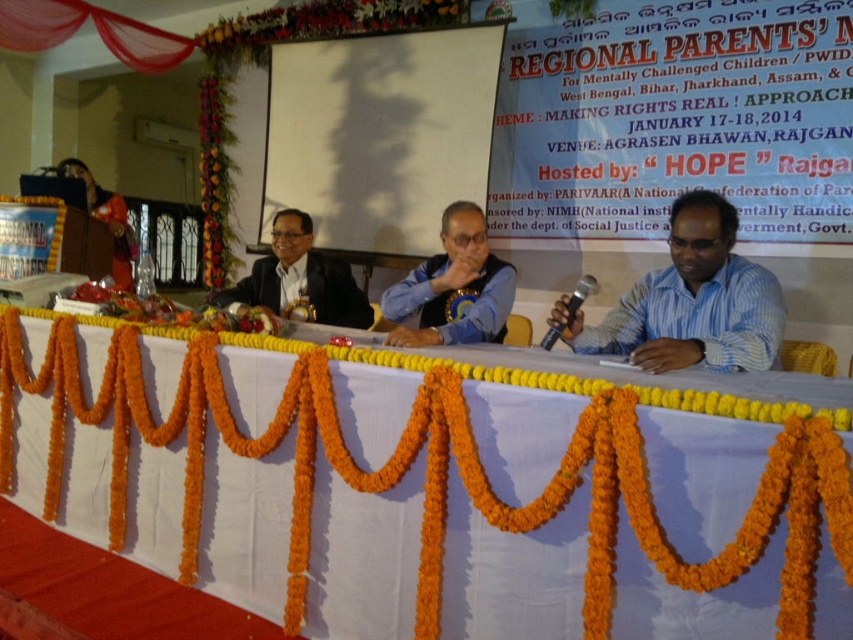
You are a photographer at the event and need to position yourself to capture both the white fabric table at center and the satin black suit at center in a single frame. Based on their positions, which object should you focus on first to ensure both are in the shot?

The white fabric table at center is below the satin black suit at center, so you should focus on the satin black suit at center first to ensure both are in the shot.

Based on the scene description and the objects provided, what is the purpose of the point labeled as point [428,470]?

The point labeled as point [428,470] represents the white fabric table at center.

You are organizing a small discussion group during the Regional Parents Meeting. You need to place a 1.2 meter wide discussion table at the center of the room. The existing white fabric table at center is currently occupying the space. Can you move it to a different location without blocking the banner? Please explain your reasoning.

The white fabric table at center is located at point (428, 470). Since the banner is in the background, moving the table to a position closer to the front or sides of the hall would avoid blocking it. However, the exact feasibility depends on the hall layout and available space not specified here.